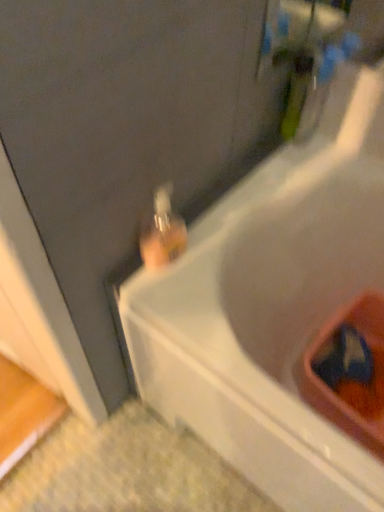
Question: Can you confirm if white plastic bathtub at upper right is positioned to the left of translucent glass bottle at upper center?

Choices:
 (A) no
 (B) yes

Answer: (A)

Question: Considering the relative sizes of white plastic bathtub at upper right and translucent glass bottle at upper center in the image provided, is white plastic bathtub at upper right smaller than translucent glass bottle at upper center?

Choices:
 (A) yes
 (B) no

Answer: (B)

Question: Is white plastic bathtub at upper right to the right of translucent glass bottle at upper center from the viewer's perspective?

Choices:
 (A) yes
 (B) no

Answer: (A)

Question: From the image's perspective, would you say white plastic bathtub at upper right is shown under translucent glass bottle at upper center?

Choices:
 (A) no
 (B) yes

Answer: (B)

Question: Is white plastic bathtub at upper right further to camera compared to translucent glass bottle at upper center?

Choices:
 (A) yes
 (B) no

Answer: (B)

Question: Can you confirm if white plastic bathtub at upper right is thinner than translucent glass bottle at upper center?

Choices:
 (A) yes
 (B) no

Answer: (B)

Question: Considering the relative sizes of translucent glass bottle at upper center and white plastic bathtub at upper right in the image provided, is translucent glass bottle at upper center bigger than white plastic bathtub at upper right?

Choices:
 (A) yes
 (B) no

Answer: (B)

Question: Considering the relative sizes of translucent glass bottle at upper center and white plastic bathtub at upper right in the image provided, is translucent glass bottle at upper center taller than white plastic bathtub at upper right?

Choices:
 (A) no
 (B) yes

Answer: (A)

Question: Is translucent glass bottle at upper center smaller than white plastic bathtub at upper right?

Choices:
 (A) yes
 (B) no

Answer: (A)

Question: From a real-world perspective, is translucent glass bottle at upper center physically below white plastic bathtub at upper right?

Choices:
 (A) yes
 (B) no

Answer: (B)

Question: Does translucent glass bottle at upper center appear on the right side of white plastic bathtub at upper right?

Choices:
 (A) no
 (B) yes

Answer: (A)

Question: Is translucent glass bottle at upper center aimed at white plastic bathtub at upper right?

Choices:
 (A) yes
 (B) no

Answer: (B)

Question: In the image, is translucent glass bottle at upper center on the left side or the right side of white plastic bathtub at upper right?

Choices:
 (A) right
 (B) left

Answer: (B)